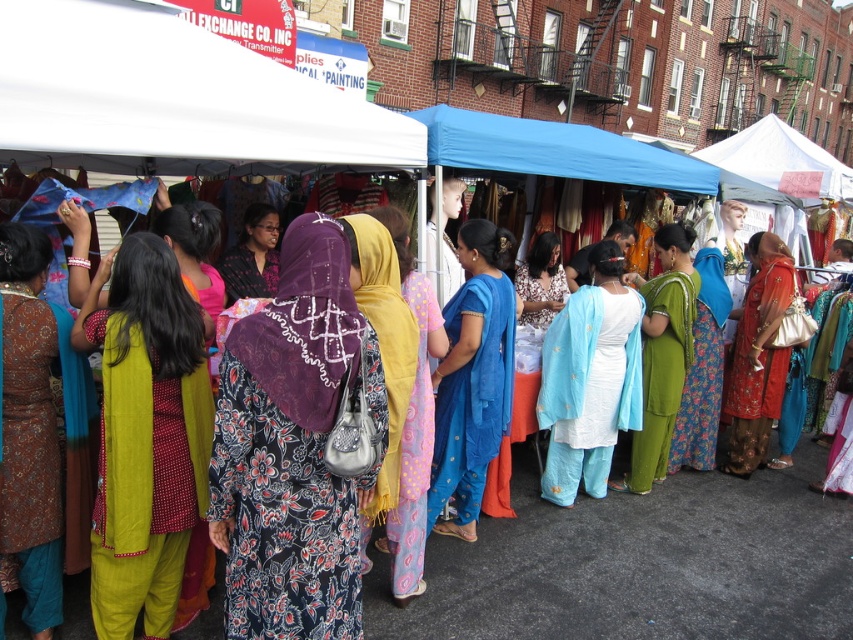
Which is below, brown printed fabric dress at center or blue silk saree at center?

brown printed fabric dress at center

Is brown printed fabric dress at center above blue silk saree at center?

Incorrect, brown printed fabric dress at center is not positioned above blue silk saree at center.

Locate an element on the screen. This screenshot has width=853, height=640. brown printed fabric dress at center is located at coordinates (28, 428).

Which of these two, light blue fabric dress at center or blue fabric canopy at center, stands taller?

light blue fabric dress at center

Is point (608, 291) farther from camera compared to point (419, 113)?

No.

You are a GUI agent. You are given a task and a screenshot of the screen. Output one action in this format:
    pyautogui.click(x=<x>, y=<y>)
    Task: Click on the light blue fabric dress at center
    The height and width of the screenshot is (640, 853).
    Given the screenshot: What is the action you would take?
    pyautogui.click(x=590, y=380)

Is floral fabric dress at center bigger than embroidered silk dress at center?

No.

Is point (363, 522) in front of point (759, 353)?

That is True.

Which is behind, point (439, 340) or point (759, 451)?

The point (759, 451) is more distant.

Identify the location of floral fabric dress at center. (407, 420).